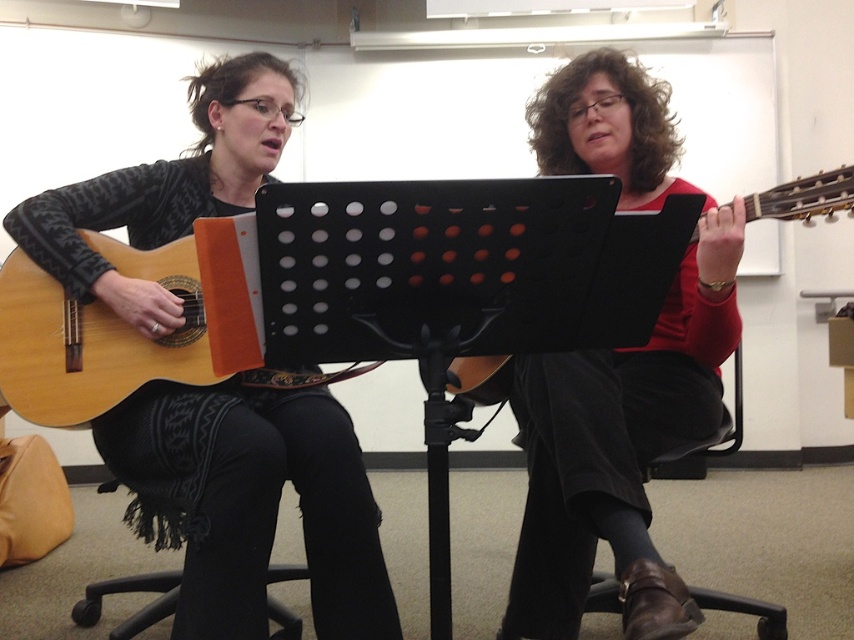
Question: Is matte black guitar at left positioned behind matte red sweater at center?

Choices:
 (A) no
 (B) yes

Answer: (B)

Question: Which object is the farthest from the black leather chair at lower center?

Choices:
 (A) black fabric bar stool at lower left
 (B) matte black guitar at left
 (C) matte red sweater at center
 (D) matte brown guitar at right

Answer: (A)

Question: Is matte brown guitar at right behind black fabric bar stool at lower left?

Choices:
 (A) no
 (B) yes

Answer: (A)

Question: Among these objects, which one is farthest from the camera?

Choices:
 (A) black fabric bar stool at lower left
 (B) matte red sweater at center
 (C) matte brown guitar at right
 (D) matte black guitar at left

Answer: (A)

Question: Is light brown acoustic guitar at left wider than black fabric bar stool at lower left?

Choices:
 (A) no
 (B) yes

Answer: (B)

Question: Estimate the real-world distances between objects in this image. Which object is farther from the black leather chair at lower center?

Choices:
 (A) light brown acoustic guitar at left
 (B) black fabric bar stool at lower left
 (C) matte red sweater at center
 (D) matte black guitar at left

Answer: (B)